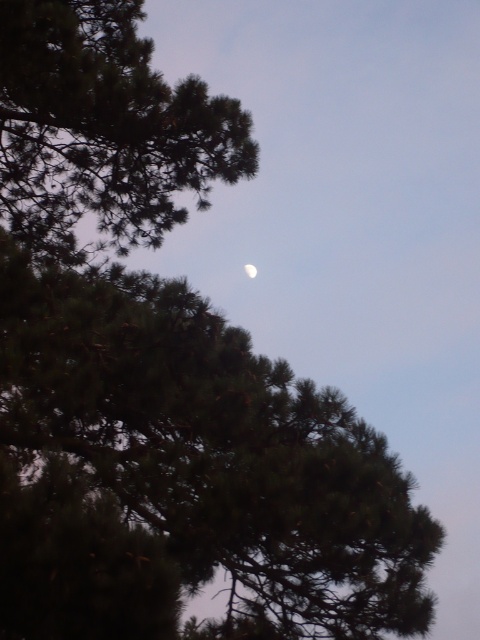
You are an astronomer observing the night sky. You notice the green matte tree at upper left and the white glossy moon at upper center. Which object appears bigger in the sky?

The green matte tree at upper left appears bigger in the sky compared to the white glossy moon at upper center because it has a larger size.